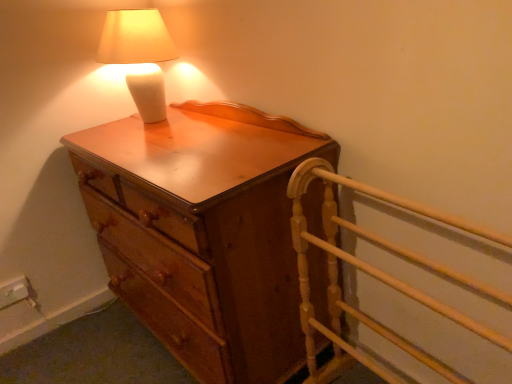
Question: Considering the positions of matte white lamp at upper left and wooden chest of drawers at center in the image, is matte white lamp at upper left taller or shorter than wooden chest of drawers at center?

Choices:
 (A) short
 (B) tall

Answer: (A)

Question: From the image's perspective, is matte white lamp at upper left positioned above or below wooden chest of drawers at center?

Choices:
 (A) above
 (B) below

Answer: (A)

Question: Which is nearer to the matte white lamp at upper left?

Choices:
 (A) light wood bed frame at right
 (B) wooden chest of drawers at center

Answer: (B)

Question: Estimate the real-world distances between objects in this image. Which object is farther from the light wood bed frame at right?

Choices:
 (A) wooden chest of drawers at center
 (B) matte white lamp at upper left

Answer: (B)